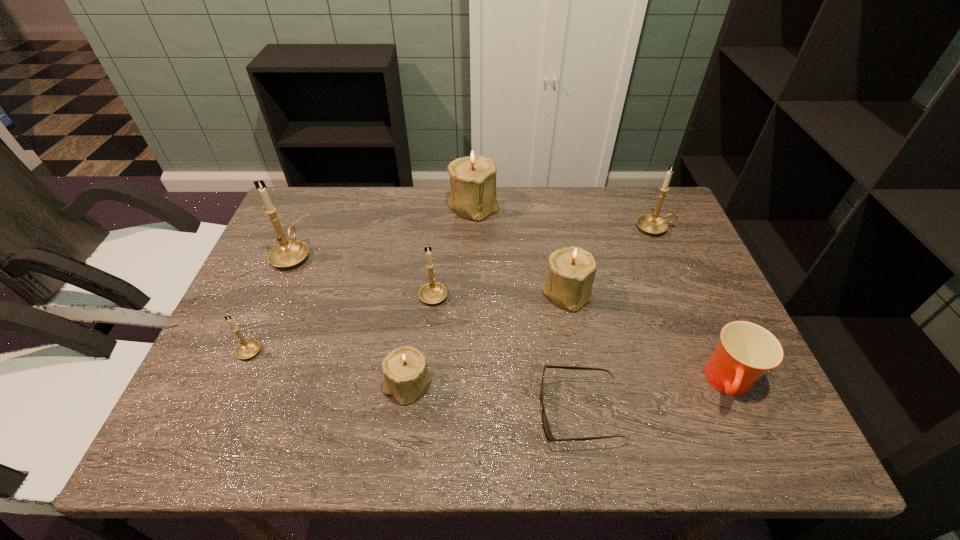
Find the location of a particular element. This screenshot has width=960, height=540. the third closest beige candle_holder relative to the cup is located at coordinates (473, 177).

Identify which beige candle_holder is the second closest to the sixth farthest candle_holder. Please provide its 2D coordinates. Your answer should be formatted as a tuple, i.e. [(x, y)], where the tuple contains the x and y coordinates of a point satisfying the conditions above.

[(473, 177)]

The width and height of the screenshot is (960, 540). Identify the location of free space that satisfies the following two spatial constraints: 1. on the handle side of the third gold candle holder from left to right; 2. on the right side of the biggest beige candle_holder. (443, 205).

The height and width of the screenshot is (540, 960). I want to click on free region that satisfies the following two spatial constraints: 1. on the back side of the biggest beige candle_holder; 2. on the right side of the leftmost beige candle_holder, so click(x=430, y=205).

I want to click on vacant space that satisfies the following two spatial constraints: 1. on the handle side of the rightmost candle_holder; 2. on the left side of the cup, so click(721, 383).

Where is `free space that satisfies the following two spatial constraints: 1. on the back side of the second nearest beige candle_holder; 2. on the right side of the nearest beige candle_holder`? free space that satisfies the following two spatial constraints: 1. on the back side of the second nearest beige candle_holder; 2. on the right side of the nearest beige candle_holder is located at coordinates 420,292.

I want to click on free space that satisfies the following two spatial constraints: 1. on the handle side of the second gold candle holder from right to left; 2. on the left side of the second farthest beige candle_holder, so click(x=434, y=292).